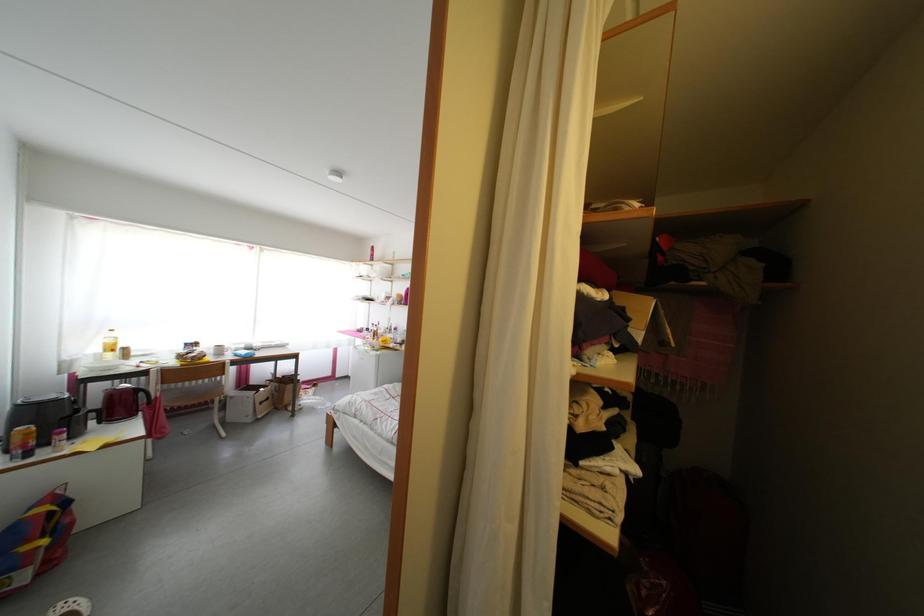
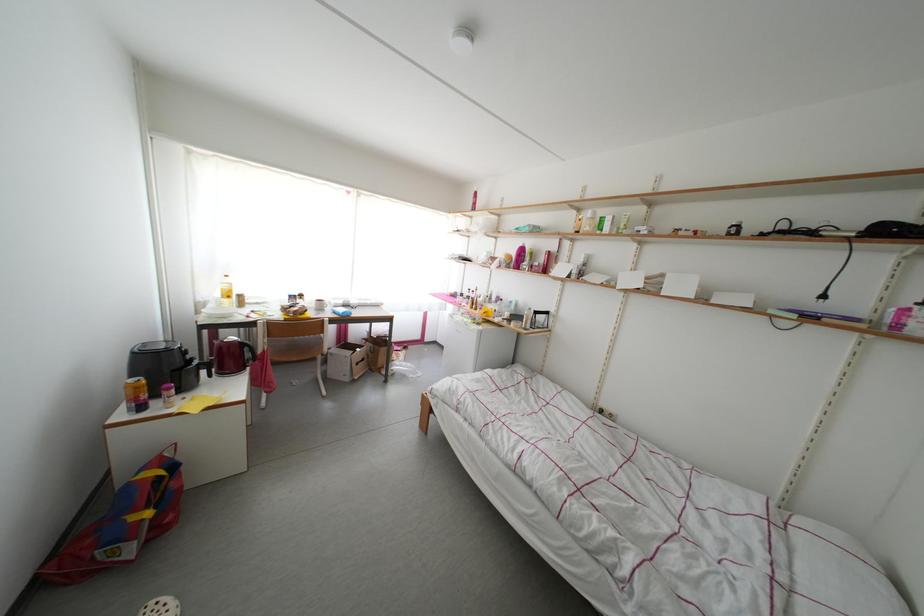
What movement of the cameraman would produce the second image?

The cameraman moved toward left, forward.